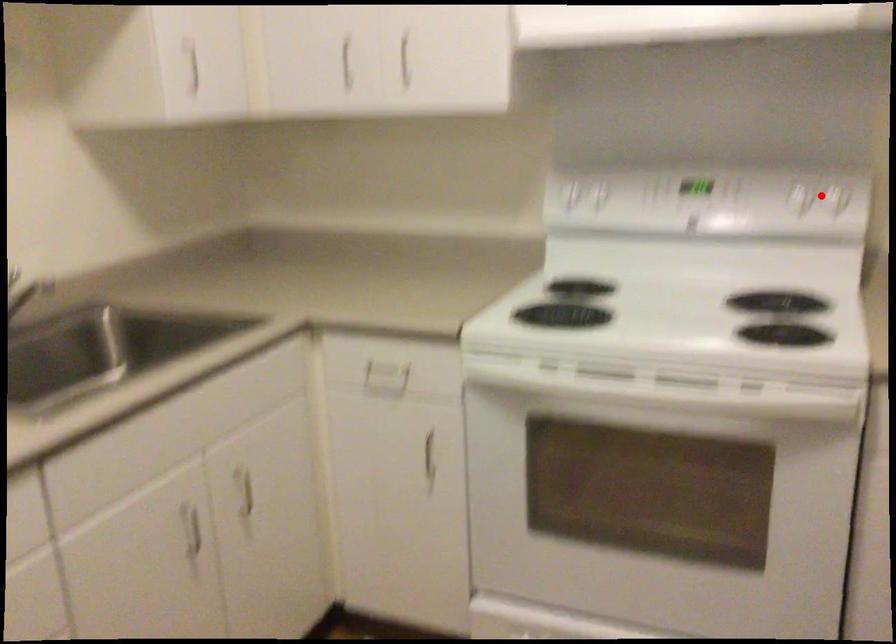
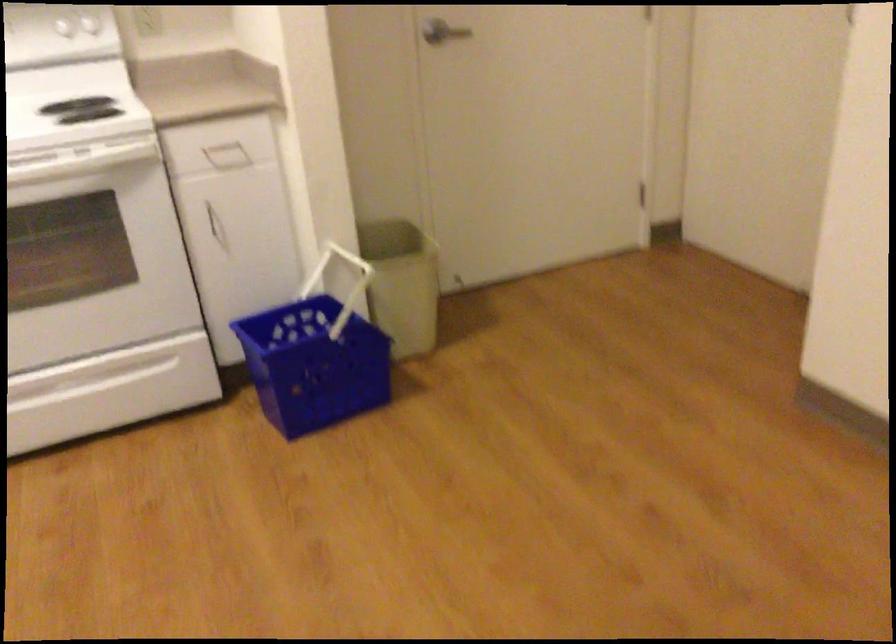
Where in the second image is the point corresponding to the highlighted location from the first image?

(80, 26)